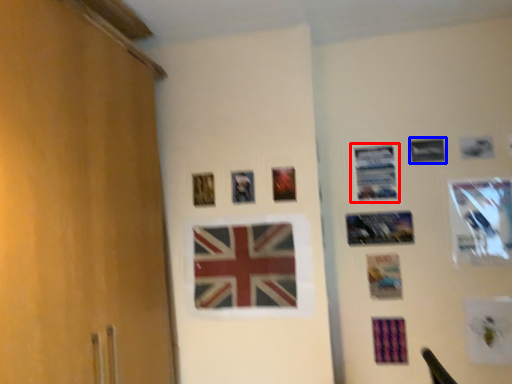
Question: Among these objects, which one is farthest to the camera, picture frame (highlighted by a red box) or picture frame (highlighted by a blue box)?

Choices:
 (A) picture frame
 (B) picture frame

Answer: (A)